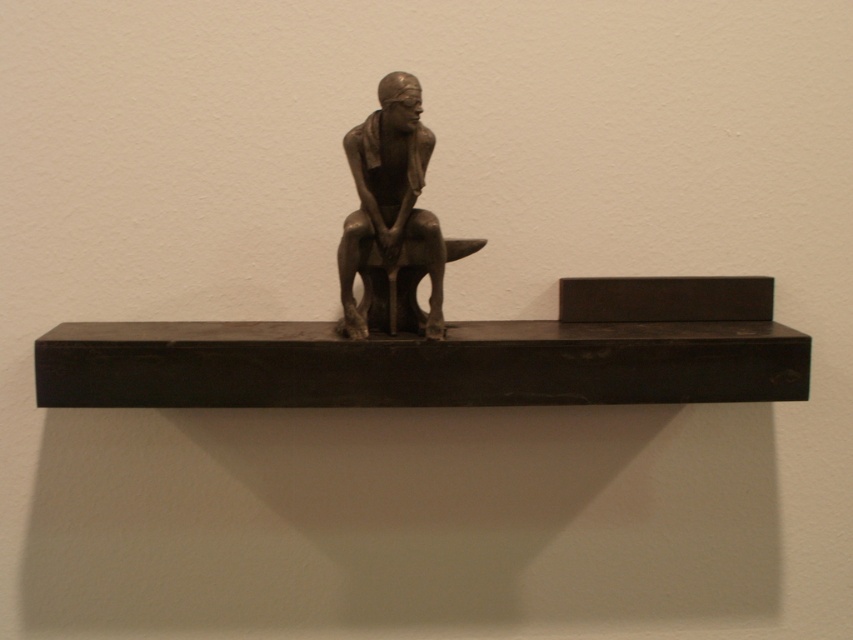
You are an art conservator who needs to ensure proper spacing between the bronze statue at center and the edge of the black wood shelf at center for preservation purposes. The recommended minimum distance is 7 inches. Based on the image, is the current spacing sufficient?

The distance between the black wood shelf at center and the bronze statue at center is 6.85 inches, which is slightly less than the recommended 7 inches. Therefore, the current spacing is insufficient and adjustments are needed to meet preservation standards.

You are an art curator planning to install a new sculpture in a gallery. The sculpture you want to place is exactly the same size as the bronze statue at center. The gallery has a display shelf that is the same size as the black wood shelf at center. Will the new sculpture fit on the display shelf?

The black wood shelf at center is larger in size than bronze statue at center. Since the new sculpture is the same size as the bronze statue at center and the display shelf is the same size as the black wood shelf at center, the sculpture will fit on the shelf.